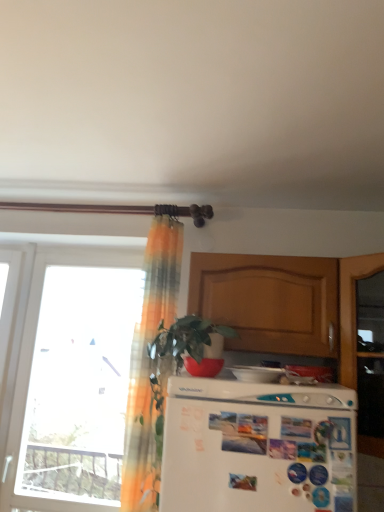
Question: Considering the relative sizes of white glossy refrigerator at center, arranged as the 2th appliance when viewed from the back, and wooden cabinet at upper center in the image provided, is white glossy refrigerator at center, arranged as the 2th appliance when viewed from the back, taller than wooden cabinet at upper center?

Choices:
 (A) no
 (B) yes

Answer: (A)

Question: Is white glossy refrigerator at center, which is the 1th appliance in left-to-right order, behind wooden cabinet at upper center?

Choices:
 (A) no
 (B) yes

Answer: (A)

Question: Is white glossy refrigerator at center, arranged as the 2th appliance when viewed from the back, turned away from wooden cabinet at upper center?

Choices:
 (A) no
 (B) yes

Answer: (A)

Question: From the image's perspective, is white glossy refrigerator at center, the first appliance from the front, on wooden cabinet at upper center?

Choices:
 (A) no
 (B) yes

Answer: (A)

Question: Does white glossy refrigerator at center, positioned as the second appliance in right-to-left order, have a greater width compared to wooden cabinet at upper center?

Choices:
 (A) yes
 (B) no

Answer: (B)

Question: Based on their sizes in the image, would you say white glossy refrigerator at lower center, the 2th appliance when ordered from left to right, is bigger or smaller than wooden cabinet at upper center?

Choices:
 (A) small
 (B) big

Answer: (A)

Question: Is white glossy refrigerator at lower center, which appears as the first appliance when viewed from the back, spatially inside wooden cabinet at upper center, or outside of it?

Choices:
 (A) inside
 (B) outside

Answer: (B)

Question: In terms of width, does white glossy refrigerator at lower center, which appears as the first appliance when viewed from the back, look wider or thinner when compared to wooden cabinet at upper center?

Choices:
 (A) wide
 (B) thin

Answer: (B)

Question: From a real-world perspective, is white glossy refrigerator at lower center, placed as the first appliance when sorted from right to left, physically located above or below wooden cabinet at upper center?

Choices:
 (A) above
 (B) below

Answer: (B)

Question: From a real-world perspective, is white glossy refrigerator at lower center, placed as the first appliance when sorted from right to left, physically located above or below translucent orange curtain at upper left?

Choices:
 (A) above
 (B) below

Answer: (B)

Question: Is white glossy refrigerator at lower center, the 2th appliance when ordered from left to right, wider or thinner than translucent orange curtain at upper left?

Choices:
 (A) wide
 (B) thin

Answer: (B)

Question: Considering the positions of white glossy refrigerator at lower center, which appears as the first appliance when viewed from the back, and translucent orange curtain at upper left in the image, is white glossy refrigerator at lower center, which appears as the first appliance when viewed from the back, taller or shorter than translucent orange curtain at upper left?

Choices:
 (A) short
 (B) tall

Answer: (A)

Question: From the image's perspective, is white glossy refrigerator at lower center, which appears as the first appliance when viewed from the back, positioned above or below translucent orange curtain at upper left?

Choices:
 (A) above
 (B) below

Answer: (B)

Question: Based on their sizes in the image, would you say wooden cabinet at upper center is bigger or smaller than white glossy refrigerator at lower center, the 2th appliance when ordered from left to right?

Choices:
 (A) small
 (B) big

Answer: (B)

Question: Choose the correct answer: Is wooden cabinet at upper center inside white glossy refrigerator at lower center, placed as the first appliance when sorted from right to left, or outside it?

Choices:
 (A) outside
 (B) inside

Answer: (A)